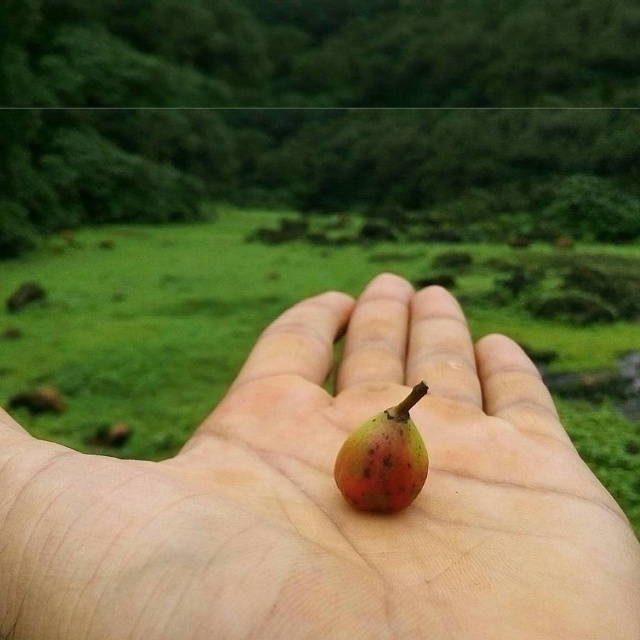
You are a photographer trying to capture the fruit in the scene. If you want to focus on the point at point (22, 504), will it be in front of or behind the point at point (372, 468)?

Point (22, 504) is in front of point (372, 468).